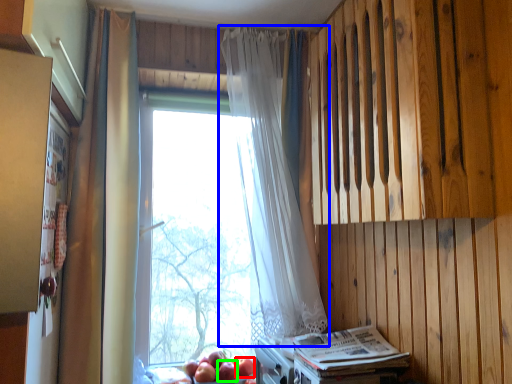
Question: Estimate the real-world distances between objects in this image. Which object is closer to apple (highlighted by a red box), curtain (highlighted by a blue box) or apple (highlighted by a green box)?

Choices:
 (A) curtain
 (B) apple

Answer: (B)